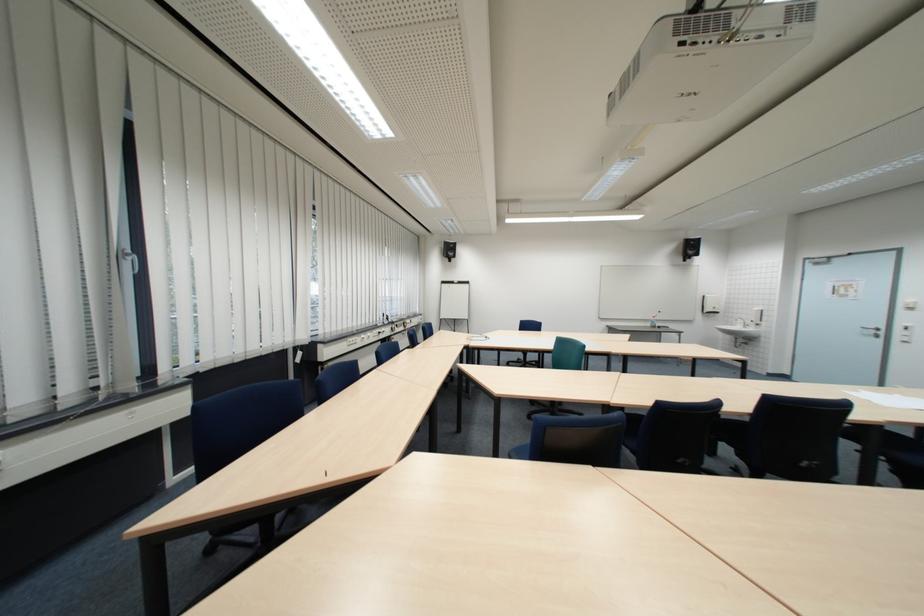
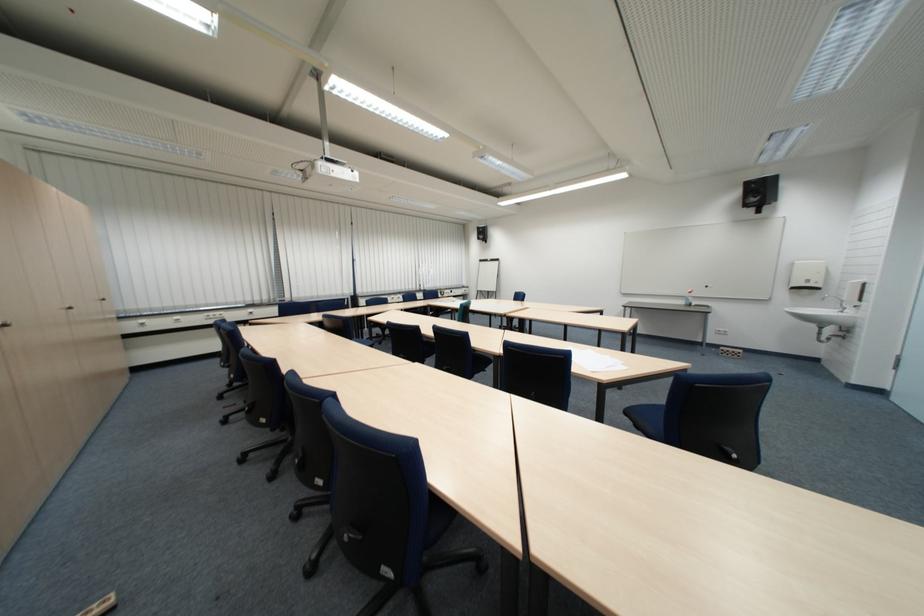
Where in the second image is the point corresponding to [662,326] from the first image?

(696, 302)